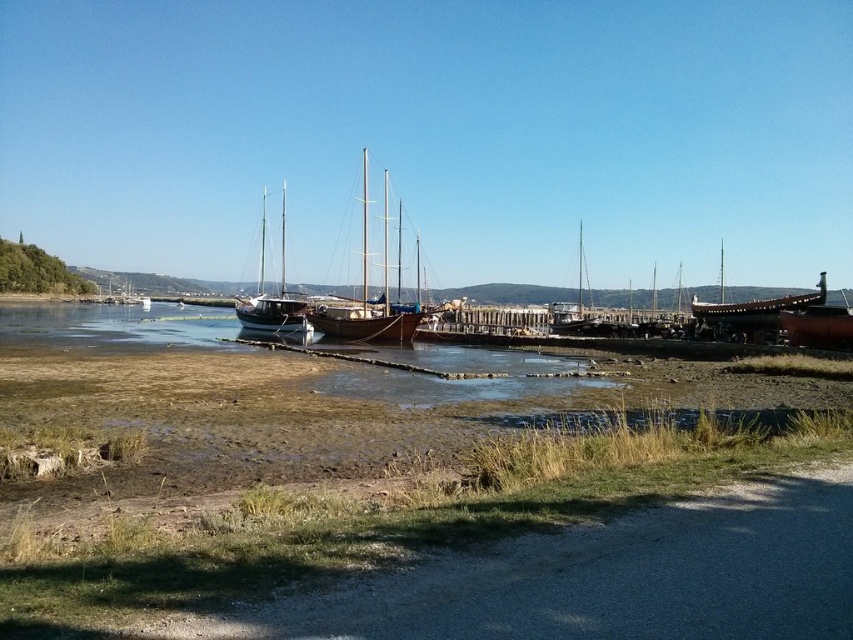
You are standing on the gravel path along the waterfront. You see the brown wooden dock at lower center and the wooden boat at right. Which object is higher in elevation compared to the other?

The brown wooden dock at lower center is taller than the wooden boat at right, so the dock is higher in elevation.

You are standing at the point labeled point (456, 394) and want to walk to the wooden structure in the background. The path is 22.08 meters long. If your walking speed is 1.5 meters per second, how many seconds will it take you to reach the wooden structure?

The distance to the wooden structure is 22.08 meters, and walking at 1.5 meters per second, it will take 22.08 divided by 1.5, which equals approximately 14.72 seconds.

You are standing on the gravel path along the shoreline and want to reach the brown wooden dock at lower center. Based on the coordinates provided, is the dock directly ahead of you or to one side?

The brown wooden dock at lower center is located at coordinates point (456,380), which places it directly ahead in the center of your view from the gravel path.